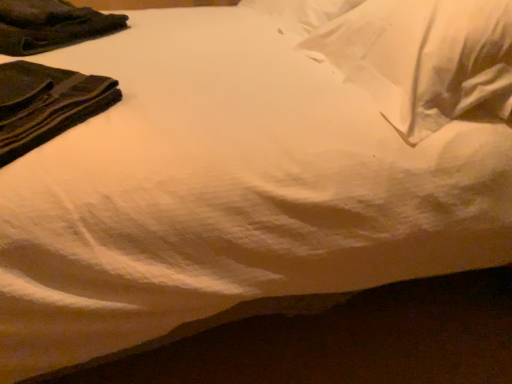
Question: Does dark green fabric at upper left, positioned as the first clothing in front-to-back order, have a greater width compared to dark green fabric at upper left, acting as the 2th clothing starting from the front?

Choices:
 (A) yes
 (B) no

Answer: (B)

Question: Is dark green fabric at upper left, the 1th clothing in the bottom-to-top sequence, outside dark green fabric at upper left, arranged as the second clothing when ordered from the bottom?

Choices:
 (A) yes
 (B) no

Answer: (A)

Question: Does dark green fabric at upper left, positioned as the first clothing in front-to-back order, appear on the right side of dark green fabric at upper left, the 1th clothing in the top-to-bottom sequence?

Choices:
 (A) yes
 (B) no

Answer: (A)

Question: Considering the relative positions of dark green fabric at upper left, positioned as the 2th clothing in top-to-bottom order, and dark green fabric at upper left, the 1th clothing in the top-to-bottom sequence, in the image provided, is dark green fabric at upper left, positioned as the 2th clothing in top-to-bottom order, in front of dark green fabric at upper left, the 1th clothing in the top-to-bottom sequence,?

Choices:
 (A) no
 (B) yes

Answer: (B)

Question: Is dark green fabric at upper left, the 1th clothing in the bottom-to-top sequence, further to camera compared to dark green fabric at upper left, the 1th clothing in the top-to-bottom sequence?

Choices:
 (A) yes
 (B) no

Answer: (B)

Question: Is dark green fabric at upper left, the 2th clothing in the back-to-front sequence, with dark green fabric at upper left, the 1th clothing in the top-to-bottom sequence?

Choices:
 (A) yes
 (B) no

Answer: (B)

Question: Considering the relative positions of dark green fabric at upper left, the 1th clothing in the top-to-bottom sequence, and white soft pillow at upper right in the image provided, is dark green fabric at upper left, the 1th clothing in the top-to-bottom sequence, in front of white soft pillow at upper right?

Choices:
 (A) yes
 (B) no

Answer: (B)

Question: From the image's perspective, is dark green fabric at upper left, acting as the 2th clothing starting from the front, under white soft pillow at upper right?

Choices:
 (A) yes
 (B) no

Answer: (B)

Question: Is dark green fabric at upper left, arranged as the second clothing when ordered from the bottom, directly adjacent to white soft pillow at upper right?

Choices:
 (A) yes
 (B) no

Answer: (B)

Question: Considering the relative sizes of dark green fabric at upper left, arranged as the second clothing when ordered from the bottom, and white soft pillow at upper right in the image provided, is dark green fabric at upper left, arranged as the second clothing when ordered from the bottom, shorter than white soft pillow at upper right?

Choices:
 (A) yes
 (B) no

Answer: (A)

Question: Is dark green fabric at upper left, the 1th clothing in the top-to-bottom sequence, located outside white soft pillow at upper right?

Choices:
 (A) yes
 (B) no

Answer: (A)

Question: Can you confirm if dark green fabric at upper left, acting as the 2th clothing starting from the front, is taller than white soft pillow at upper right?

Choices:
 (A) yes
 (B) no

Answer: (B)

Question: From a real-world perspective, is dark green fabric at upper left, arranged as the second clothing when ordered from the bottom, positioned over dark green fabric at upper left, positioned as the 2th clothing in top-to-bottom order, based on gravity?

Choices:
 (A) yes
 (B) no

Answer: (B)